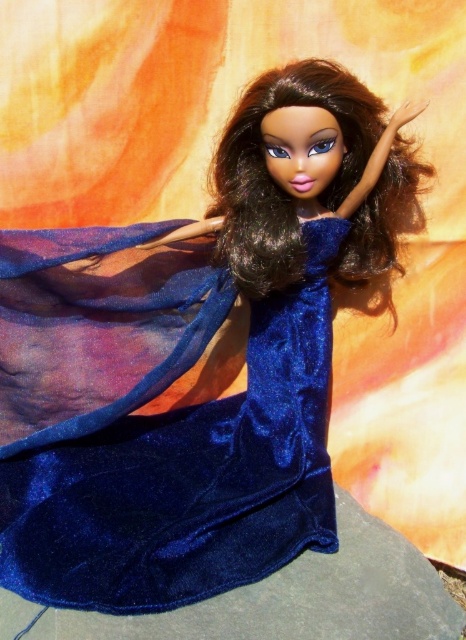
You are a fashion designer preparing to photograph the doll in the image. You want to ensure the shiny blue fabric dress at center and the shiny dark brown hair at center are both visible in the final shot. Based on their positions, which object should you focus on first to ensure both are in frame?

The shiny dark brown hair at center is positioned above the shiny blue fabric dress at center, so you should focus on ensuring the shiny dark brown hair at center is in frame first to capture both objects.

You are an interior designer planning to place a new lamp in the room where the shiny blue fabric dress at center is displayed. The lamp needs to be placed at coordinates point 0.673, 0.339. Is this location suitable for placing the lamp?

The shiny blue fabric dress at center is already positioned at point [157,429], so placing the lamp there would interfere with the dress. Choose a different location.